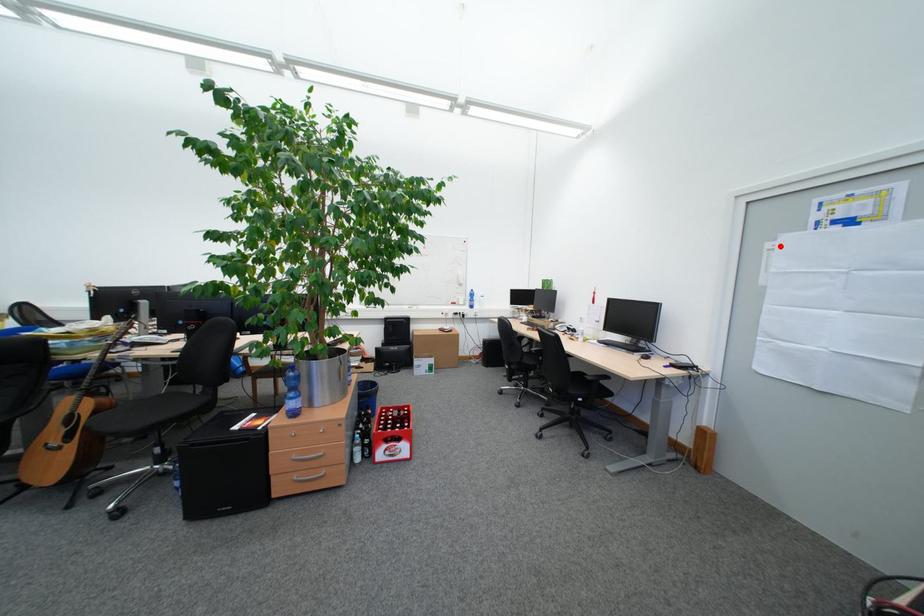
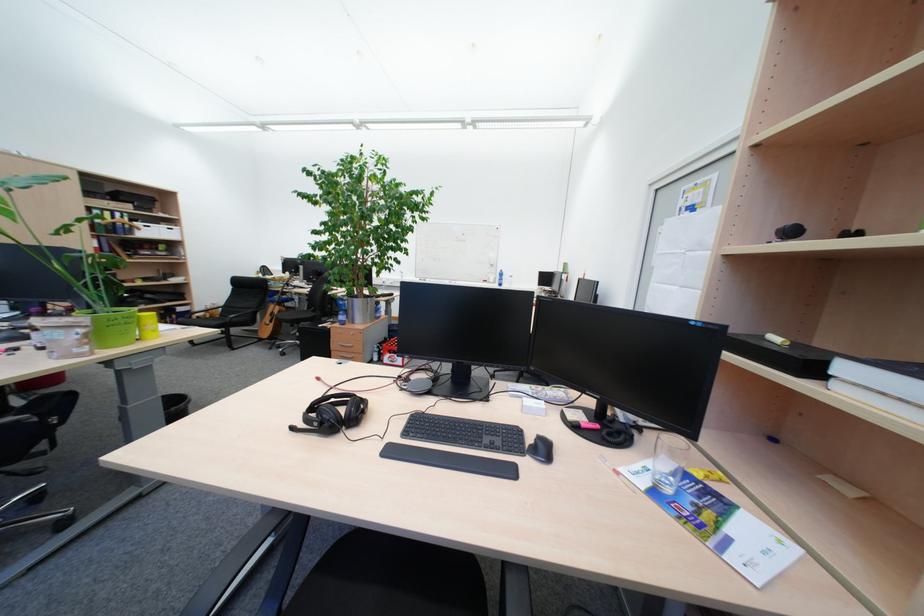
In the second image, find the point that corresponds to the highlighted location in the first image.

(671, 230)